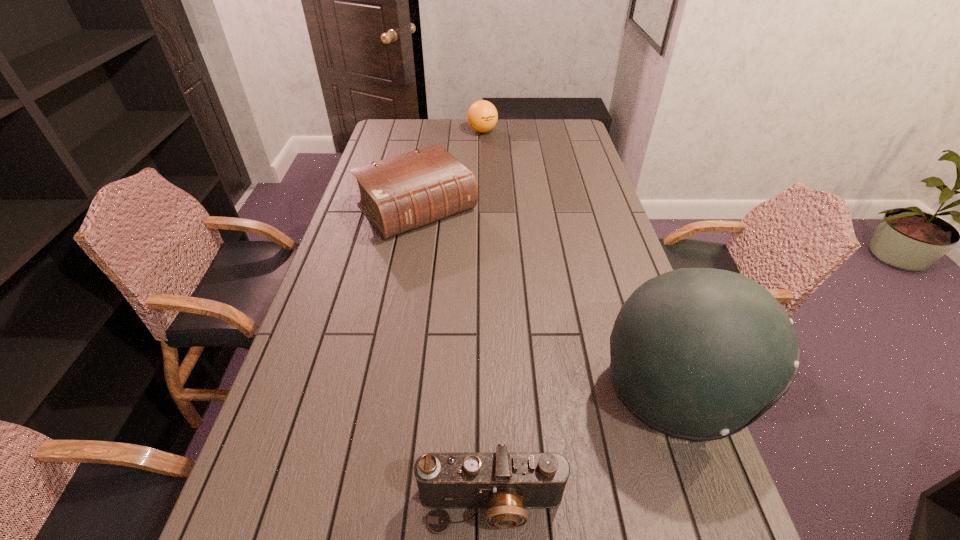
I want to click on the nearest object, so click(505, 483).

You are a GUI agent. You are given a task and a screenshot of the screen. Output one action in this format:
    pyautogui.click(x=<x>, y=<y>)
    Task: Click on the rightmost object
    The width and height of the screenshot is (960, 540).
    Given the screenshot: What is the action you would take?
    pyautogui.click(x=698, y=354)

Image resolution: width=960 pixels, height=540 pixels. Find the location of `football helmet`. football helmet is located at coordinates (698, 354).

Where is `the farthest object`? the farthest object is located at coordinates (482, 116).

Where is `Bible`? This screenshot has height=540, width=960. Bible is located at coordinates (399, 194).

I want to click on vacant area situated on the side with brand of the ping-pong ball, so click(487, 145).

This screenshot has width=960, height=540. I want to click on vacant space situated on the side with brand of the ping-pong ball, so click(x=497, y=177).

Find the location of `vacant space located 0.230m on the side with brand of the ping-pong ball`. vacant space located 0.230m on the side with brand of the ping-pong ball is located at coordinates (492, 163).

Where is `vacant area situated on the spine side of the third nearest object`? This screenshot has height=540, width=960. vacant area situated on the spine side of the third nearest object is located at coordinates (453, 247).

Identify the location of vacant space positioned on the spine side of the third nearest object. (483, 280).